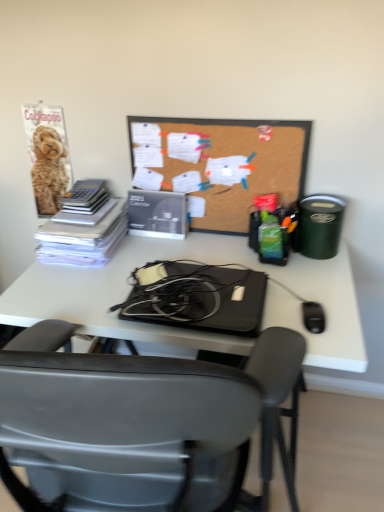
Identify the location of free space between matte black calendar at center and white paper stack at left. (145, 246).